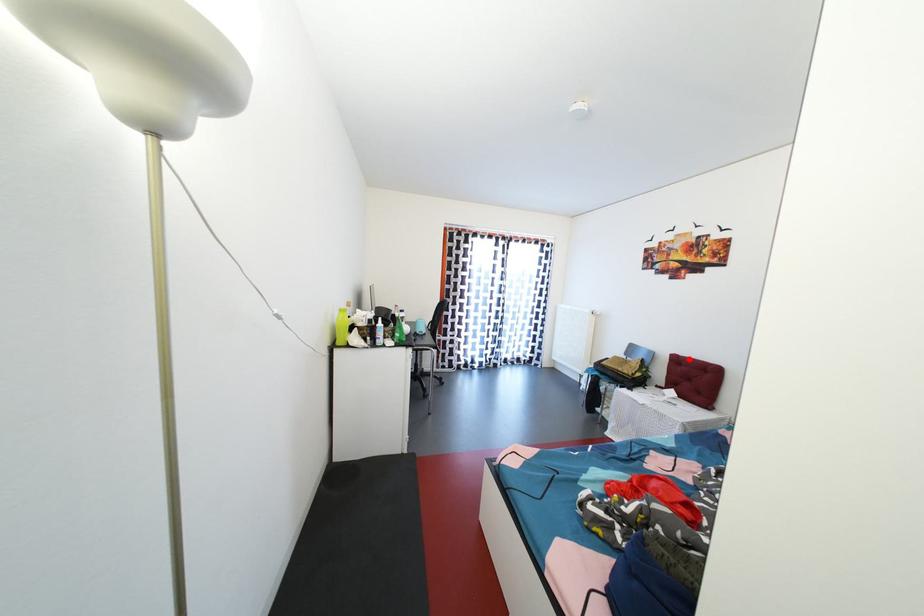
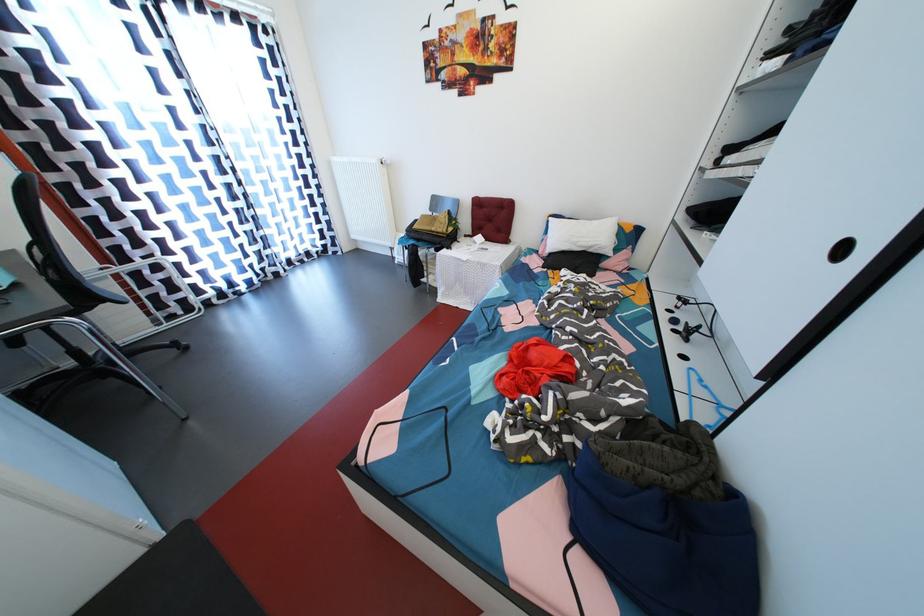
Question: I am providing you with two images of the same scene from different viewpoints. Given a red point in image1, look at the same physical point in image2. Is it:

Choices:
 (A) Closer to the viewpoint
 (B) Farther from the viewpoint

Answer: (A)